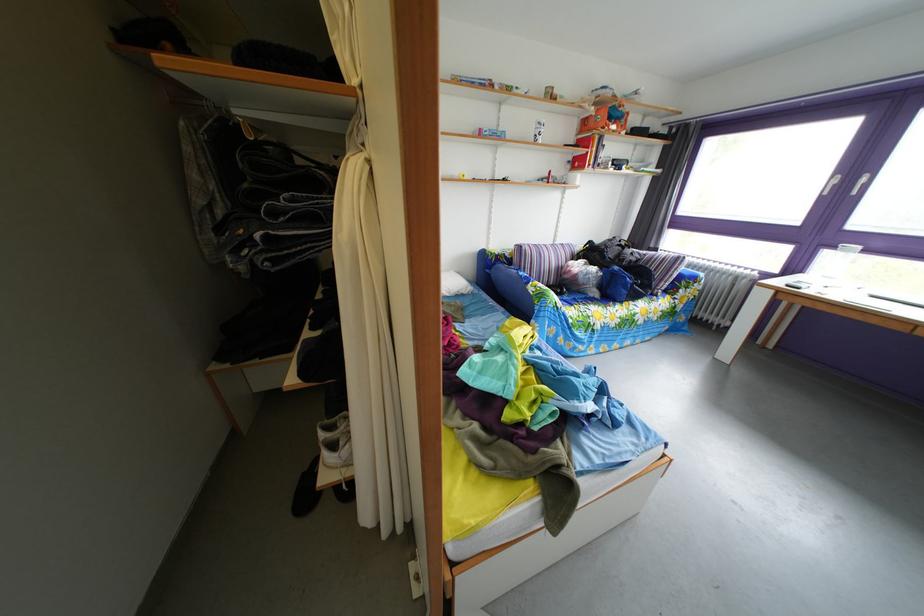
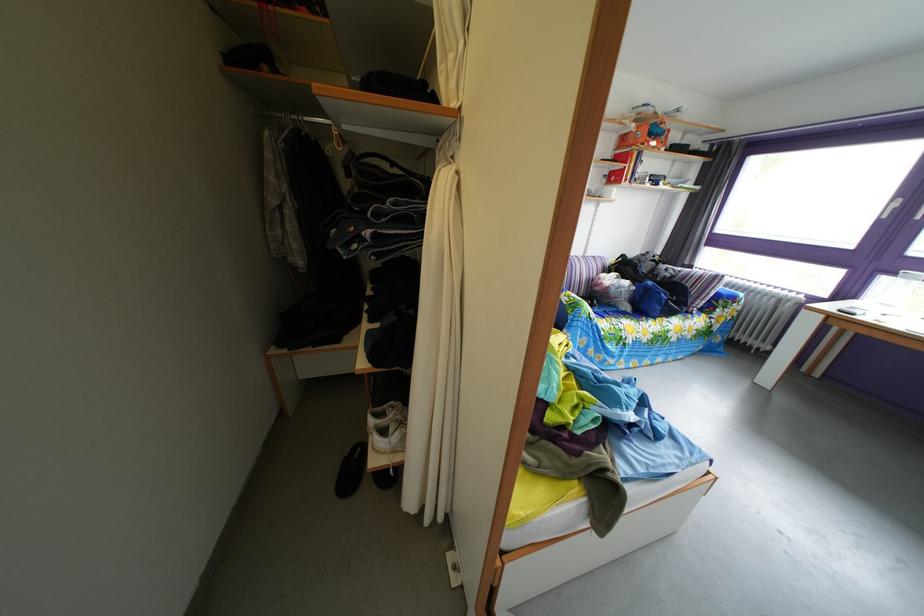
Locate, in the second image, the point that corresponds to the point at 621,128 in the first image.

(661, 144)